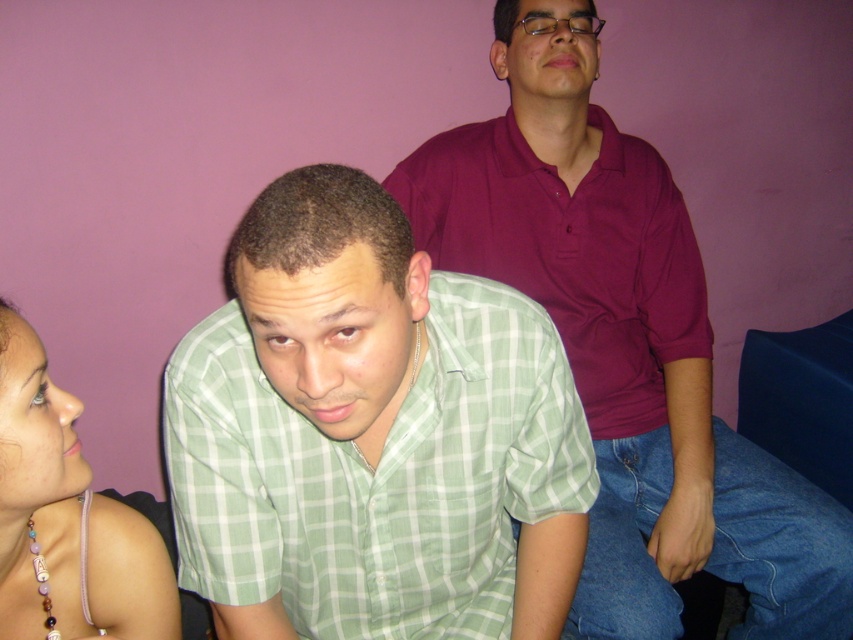
Question: Among these points, which one is nearest to the camera?

Choices:
 (A) pyautogui.click(x=357, y=396)
 (B) pyautogui.click(x=405, y=205)
 (C) pyautogui.click(x=25, y=412)
 (D) pyautogui.click(x=846, y=568)

Answer: (C)

Question: Is green checkered shirt at center to the left of pearl necklace at upper left from the viewer's perspective?

Choices:
 (A) yes
 (B) no

Answer: (B)

Question: Among these points, which one is farthest from the camera?

Choices:
 (A) (622, 333)
 (B) (62, 627)

Answer: (A)

Question: Does green checkered shirt at center come behind pearl necklace at upper left?

Choices:
 (A) no
 (B) yes

Answer: (A)

Question: Which point is closer to the camera taking this photo?

Choices:
 (A) [x=576, y=198]
 (B) [x=68, y=566]
 (C) [x=440, y=406]

Answer: (B)

Question: Is green checkered shirt at center above matte green shirt at center?

Choices:
 (A) yes
 (B) no

Answer: (B)